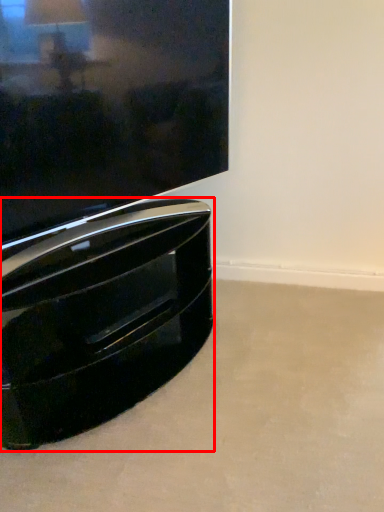
Question: From the image's perspective, what is the correct spatial positioning of furniture (annotated by the red box) in reference to television?

Choices:
 (A) above
 (B) below

Answer: (B)